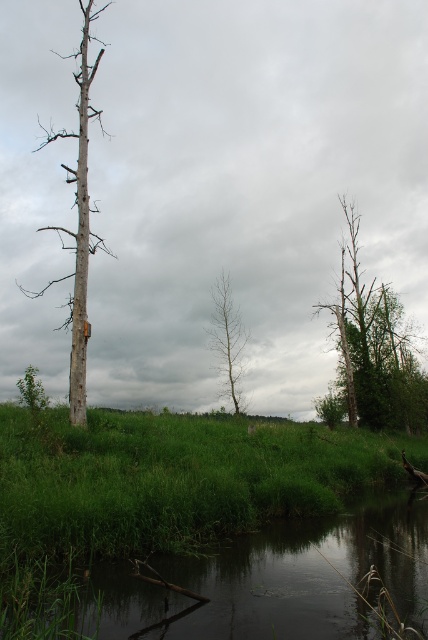
Question: Is smooth bark tree at right to the left of smooth bark tree at left from the viewer's perspective?

Choices:
 (A) yes
 (B) no

Answer: (B)

Question: Which object is closer to the camera taking this photo?

Choices:
 (A) smooth bark tree at right
 (B) bare wood tree at center

Answer: (B)

Question: Does green grassy at center appear over smooth bark tree at right?

Choices:
 (A) no
 (B) yes

Answer: (A)

Question: Which object appears closest to the camera in this image?

Choices:
 (A) bare wood tree at center
 (B) green grassy at center
 (C) smooth bark tree at left

Answer: (B)

Question: Is smooth bark tree at right thinner than smooth bark tree at left?

Choices:
 (A) yes
 (B) no

Answer: (A)

Question: Which point is closer to the camera?

Choices:
 (A) (223, 282)
 (B) (106, 452)

Answer: (B)